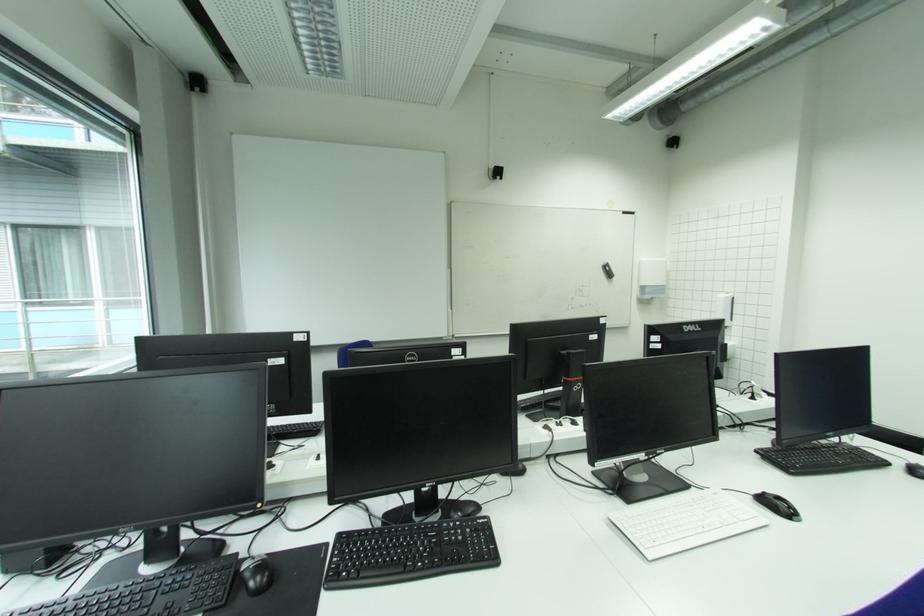
Where would you lift the black computer speaker? Please return your answer as a coordinate pair (x, y).

(594, 504)